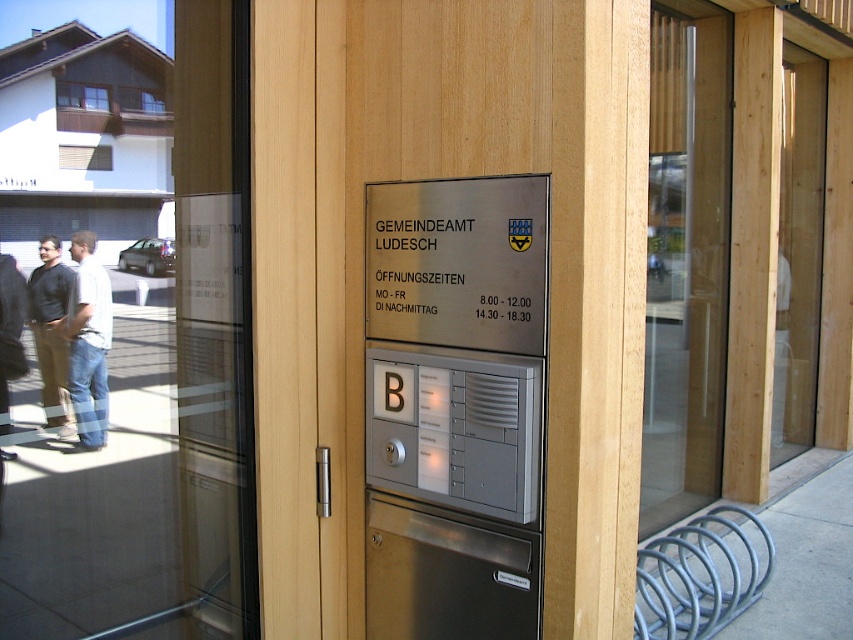
Consider the image. You are a visitor approaching the entrance of Gemeindeamt Ludesch. You see the transparent glass door at center and the metallic silver sign at center. Which object is closer to you as you approach the entrance?

The transparent glass door at center is closer to you than the metallic silver sign at center because it is further to the viewer.

You are a visitor arriving at the Gemeindeamt Ludesch entrance. You need to enter the building but are unsure which door to use. The transparent glass door at center and metallic silver sign at center are in your view. Which object is wider, and should you use the wider one for entry?

The transparent glass door at center is wider than the metallic silver sign at center. Since doors are typically used for entry, you should use the transparent glass door at center to enter the building.

You are at the entrance of Gemeindeamt Ludesch and need to find the opening hours. The metallic silver sign at center is located below the transparent glass door at center. Where should you look to see the opening hours?

The metallic silver sign at center is located below the transparent glass door at center, so you should look below the transparent glass door at center to see the opening hours.